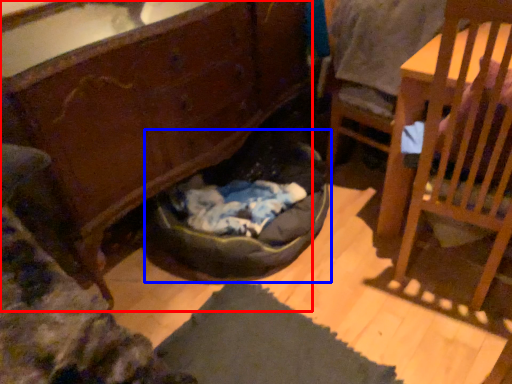
Question: Which object is closer to the camera taking this photo, cabinetry (highlighted by a red box) or bean bag chair (highlighted by a blue box)?

Choices:
 (A) cabinetry
 (B) bean bag chair

Answer: (A)